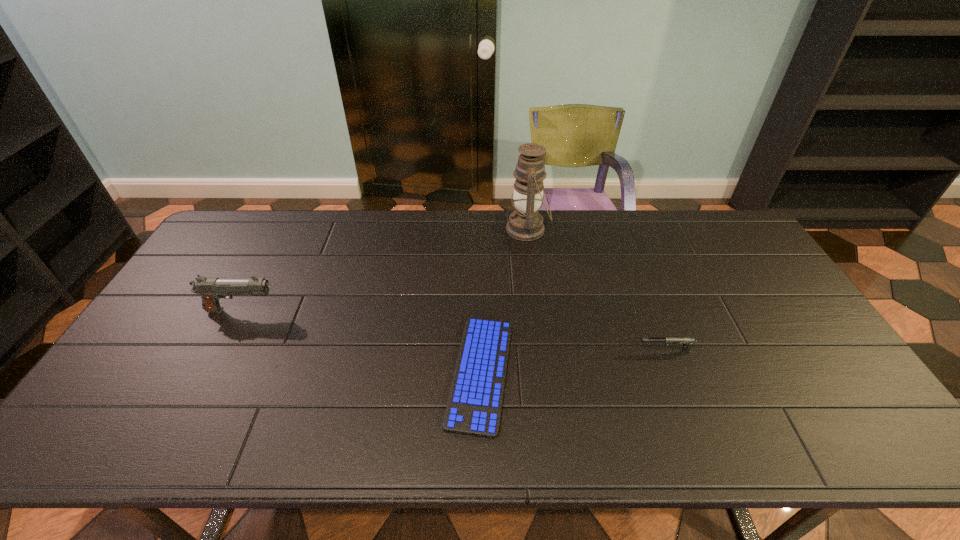
I want to click on vacant position located at the muzzle end of the nearer gun, so click(492, 352).

Identify the location of blank space located 0.070m at the muzzle end of the nearer gun. (x=612, y=352).

Where is `free spot located at the muzzle end of the nearer gun`? The image size is (960, 540). free spot located at the muzzle end of the nearer gun is located at coordinates (537, 352).

The height and width of the screenshot is (540, 960). I want to click on vacant space positioned on the left of the computer keyboard, so click(372, 374).

Find the location of a particular element. The image size is (960, 540). object that is at the far edge is located at coordinates (525, 223).

Where is `object that is at the near edge`? The image size is (960, 540). object that is at the near edge is located at coordinates (474, 405).

The image size is (960, 540). What are the coordinates of `object that is at the left edge` in the screenshot? It's located at (211, 290).

Where is `vacant area at the far edge`? The height and width of the screenshot is (540, 960). vacant area at the far edge is located at coordinates (680, 214).

This screenshot has width=960, height=540. I want to click on vacant region at the near edge of the desktop, so click(501, 434).

Find the location of a particular element. This screenshot has width=960, height=540. blank space at the left edge is located at coordinates (228, 265).